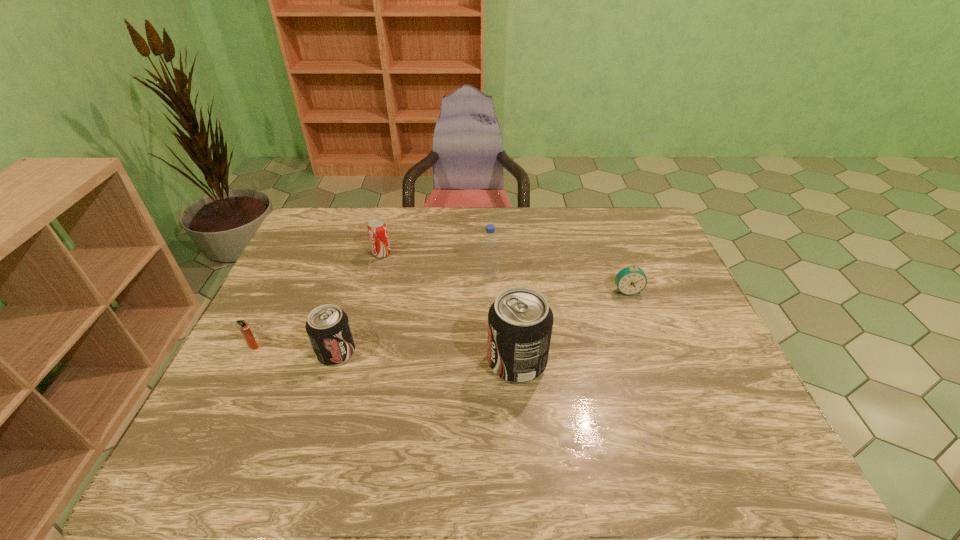
At what (x,y) coordinates should I click in order to perform the action: click on vacant spot to place a soda can on the right. Please return your answer as a coordinate pair (x, y). The image size is (960, 540). Looking at the image, I should click on (706, 372).